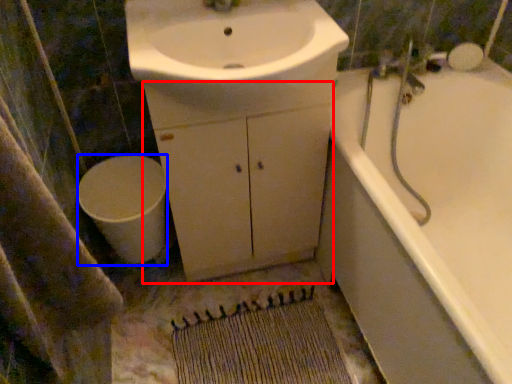
Question: Which object is closer to the camera taking this photo, cabinetry (highlighted by a red box) or toilet (highlighted by a blue box)?

Choices:
 (A) cabinetry
 (B) toilet

Answer: (A)